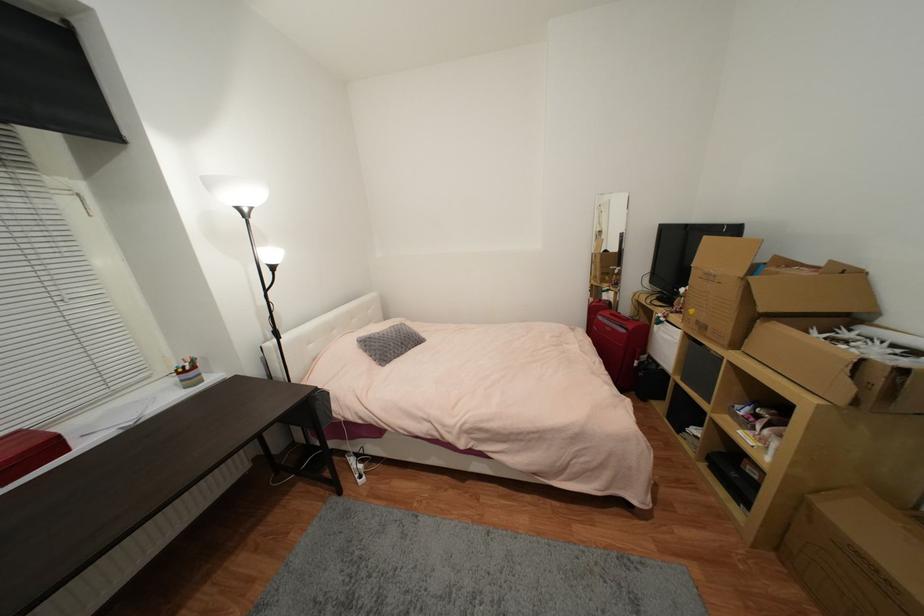
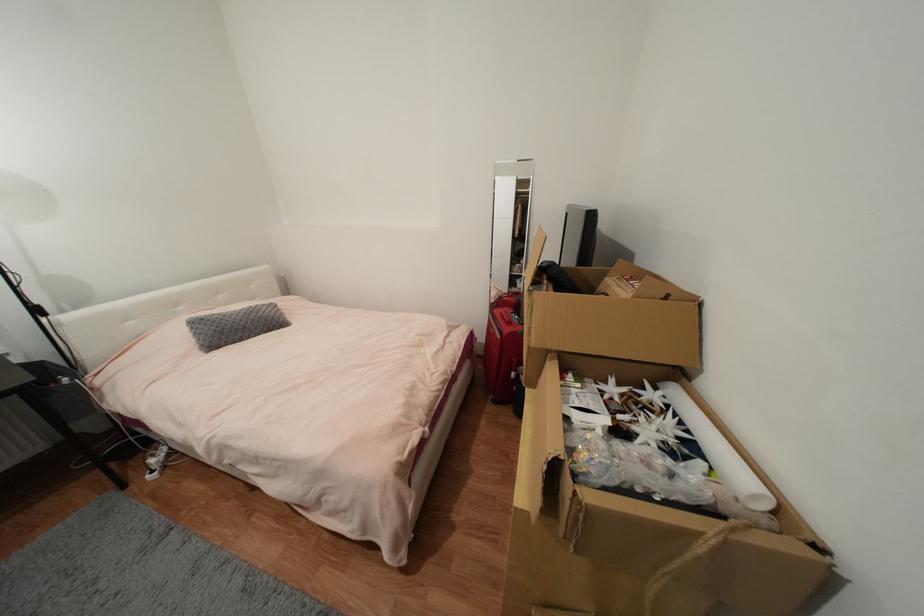
In the second image, find the point that corresponds to (x=640, y=363) in the first image.

(517, 375)